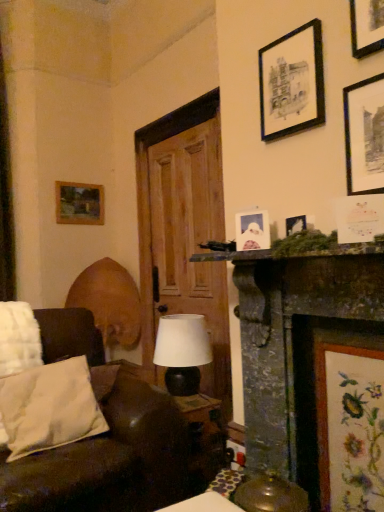
Question: Considering the relative sizes of dark gray stone fireplace at center right and wooden picture frame at upper left, which appears as the sixth picture frame when viewed from the front, in the image provided, is dark gray stone fireplace at center right shorter than wooden picture frame at upper left, which appears as the sixth picture frame when viewed from the front,?

Choices:
 (A) no
 (B) yes

Answer: (A)

Question: Considering the relative positions of dark gray stone fireplace at center right and wooden picture frame at upper left, which appears as the sixth picture frame when viewed from the front, in the image provided, is dark gray stone fireplace at center right in front of wooden picture frame at upper left, which appears as the sixth picture frame when viewed from the front,?

Choices:
 (A) no
 (B) yes

Answer: (B)

Question: Considering the relative positions of dark gray stone fireplace at center right and wooden picture frame at upper left, arranged as the first picture frame when viewed from the back, in the image provided, is dark gray stone fireplace at center right to the left of wooden picture frame at upper left, arranged as the first picture frame when viewed from the back, from the viewer's perspective?

Choices:
 (A) yes
 (B) no

Answer: (B)

Question: Is dark gray stone fireplace at center right aimed at wooden picture frame at upper left, arranged as the first picture frame when viewed from the back?

Choices:
 (A) no
 (B) yes

Answer: (A)

Question: Is dark gray stone fireplace at center right positioned behind wooden picture frame at upper left, which appears as the sixth picture frame when viewed from the front?

Choices:
 (A) no
 (B) yes

Answer: (A)

Question: Considering the positions of dark gray stone fireplace at center right and white paper picture frame at upper center, acting as the 2th picture frame starting from the bottom, in the image, is dark gray stone fireplace at center right wider or thinner than white paper picture frame at upper center, acting as the 2th picture frame starting from the bottom,?

Choices:
 (A) thin
 (B) wide

Answer: (B)

Question: From the image's perspective, is dark gray stone fireplace at center right positioned above or below white paper picture frame at upper center, acting as the 2th picture frame starting from the bottom?

Choices:
 (A) above
 (B) below

Answer: (B)

Question: Is point (332, 294) positioned closer to the camera than point (246, 238)?

Choices:
 (A) farther
 (B) closer

Answer: (B)

Question: Would you say dark gray stone fireplace at center right is inside or outside white paper picture frame at upper center, the fourth picture frame positioned from the front?

Choices:
 (A) outside
 (B) inside

Answer: (A)

Question: From a real-world perspective, is embroidered fabric at lower right, the fourth picture frame when ordered from left to right, above or below black matte picture frame at upper right, placed as the 4th picture frame when sorted from bottom to top?

Choices:
 (A) below
 (B) above

Answer: (A)

Question: Considering the positions of point (382, 499) and point (349, 113), is point (382, 499) closer or farther from the camera than point (349, 113)?

Choices:
 (A) farther
 (B) closer

Answer: (B)

Question: From their relative heights in the image, would you say embroidered fabric at lower right, the fourth picture frame when ordered from left to right, is taller or shorter than black matte picture frame at upper right, positioned as the 1th picture frame in right-to-left order?

Choices:
 (A) short
 (B) tall

Answer: (B)

Question: From the image's perspective, is embroidered fabric at lower right, the 5th picture frame when ordered from back to front, positioned above or below black matte picture frame at upper right, which appears as the sixth picture frame when viewed from the left?

Choices:
 (A) above
 (B) below

Answer: (B)

Question: Looking at their shapes, would you say matte white paper at upper right, the 1th picture frame from the front, is wider or thinner than white paper picture frame at upper center, acting as the 2th picture frame starting from the bottom?

Choices:
 (A) wide
 (B) thin

Answer: (A)

Question: From the image's perspective, is matte white paper at upper right, which appears as the third picture frame when ordered from the bottom, positioned above or below white paper picture frame at upper center, acting as the 2th picture frame starting from the bottom?

Choices:
 (A) above
 (B) below

Answer: (A)